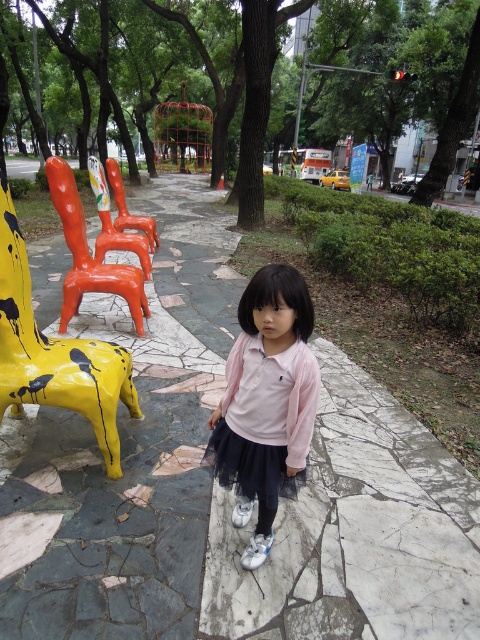
You are a photographer setting up a shoot in this urban outdoor area. You need to place a small tripod between the yellow painted plastic chair at left and the orange glossy chair at left. Based on their positions, which chair should the tripod be closer to?

The yellow painted plastic chair at left is positioned on the right side of the orange glossy chair at left, so the tripod should be placed closer to the orange glossy chair at left to ensure it is between them.

You are a photographer trying to capture the girl in the pink satin shirt at center and the orange glossy chair at left. Based on their heights, which one should you focus on first if you want to ensure both are in frame without cropping?

The orange glossy chair at left is taller than the pink satin shirt at center. To ensure both are in frame without cropping, focus on the orange glossy chair at left first as it is taller, allowing the shorter pink satin shirt at center to naturally fit within the composition.

You are a delivery person trying to navigate through the outdoor urban scene. You need to deliver a package to the white marble pavement at center. From the orange glossy chair at center, which direction should you move to reach the destination?

The white marble pavement at center is to the right of the orange glossy chair at center, so you should move to the right to reach it.